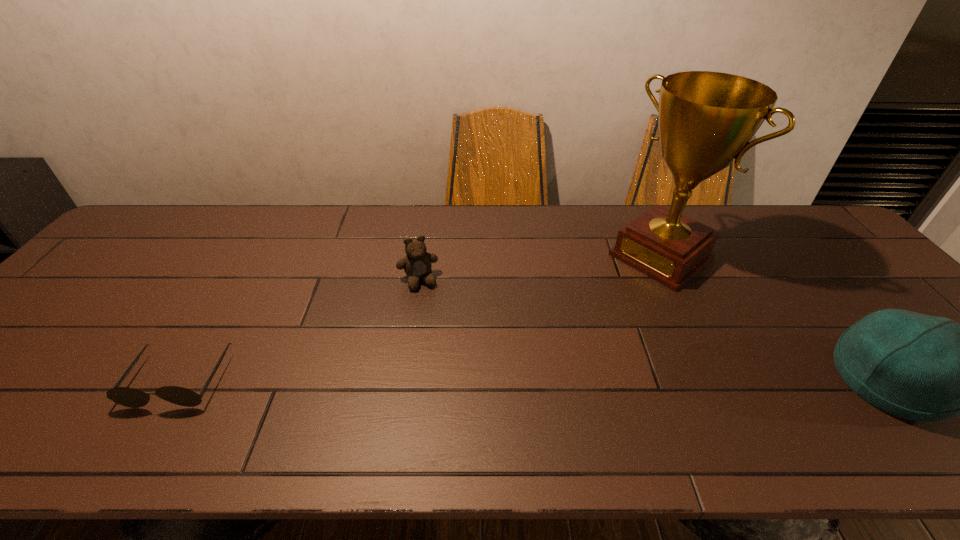
The height and width of the screenshot is (540, 960). I want to click on free point located 0.050m on the face of the teddy bear, so click(x=427, y=305).

The height and width of the screenshot is (540, 960). I want to click on free spot located 0.070m on the face of the teddy bear, so click(x=429, y=310).

The image size is (960, 540). I want to click on object that is at the far edge, so [706, 119].

You are a GUI agent. You are given a task and a screenshot of the screen. Output one action in this format:
    pyautogui.click(x=<x>, y=<y>)
    Task: Click on the object that is positioned at the near edge
    Image resolution: width=960 pixels, height=540 pixels.
    Given the screenshot: What is the action you would take?
    pyautogui.click(x=129, y=397)

Image resolution: width=960 pixels, height=540 pixels. I want to click on vacant space at the far edge of the desktop, so click(512, 249).

The image size is (960, 540). What are the coordinates of `vacant space at the near edge of the desktop` in the screenshot? It's located at (612, 386).

The image size is (960, 540). Identify the location of vacant area at the left edge. (113, 294).

Where is `free space at the right edge of the desktop`? The image size is (960, 540). free space at the right edge of the desktop is located at coordinates (850, 261).

The image size is (960, 540). I want to click on vacant region at the near left corner of the desktop, so click(x=31, y=396).

Locate an element on the screen. vacant space that is in between the shortest object and the tallest object is located at coordinates (420, 318).